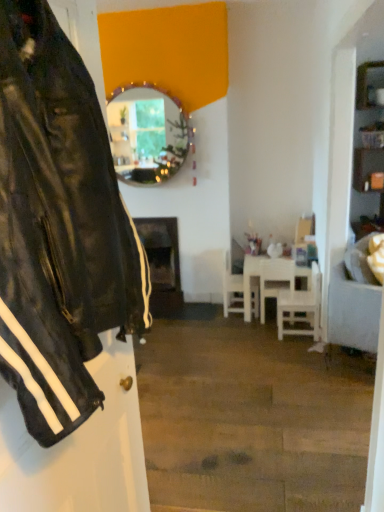
Find the location of a particular element. vacant area that lies in front of white glossy chair at center, the second chair when ordered from right to left is located at coordinates (260, 329).